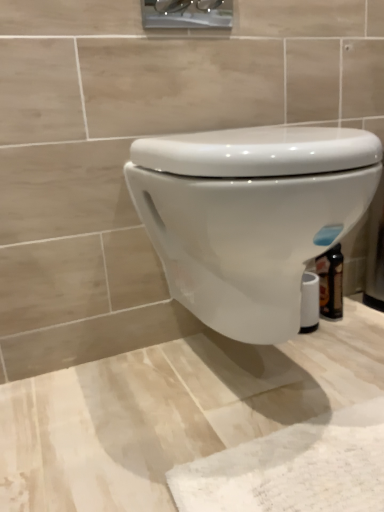
Locate an element on the screen. The width and height of the screenshot is (384, 512). vacant area situated below white glossy toilet at center (from a real-world perspective) is located at coordinates (249, 384).